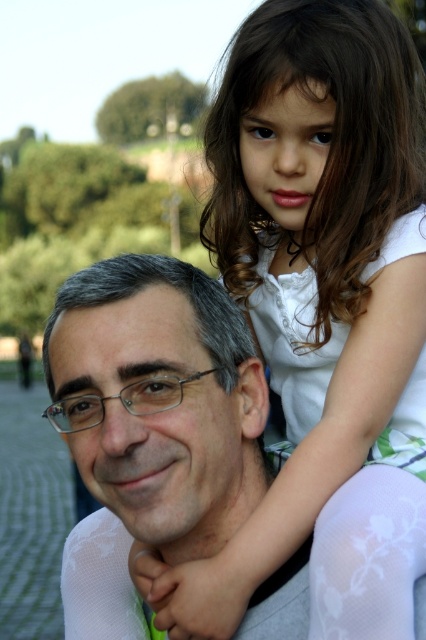
Question: Which object appears closest to the camera in this image?

Choices:
 (A) matte gray shirt at center
 (B) white cotton shirt at upper right

Answer: (B)

Question: Is white cotton shirt at upper right thinner than matte gray shirt at center?

Choices:
 (A) yes
 (B) no

Answer: (B)

Question: Which object is farther from the camera taking this photo?

Choices:
 (A) white cotton shirt at upper right
 (B) matte gray shirt at center

Answer: (B)

Question: Does white cotton shirt at upper right have a greater width compared to matte gray shirt at center?

Choices:
 (A) no
 (B) yes

Answer: (B)

Question: Does white cotton shirt at upper right appear under matte gray shirt at center?

Choices:
 (A) yes
 (B) no

Answer: (B)

Question: Among these points, which one is farthest from the camera?

Choices:
 (A) (405, 534)
 (B) (233, 353)

Answer: (B)